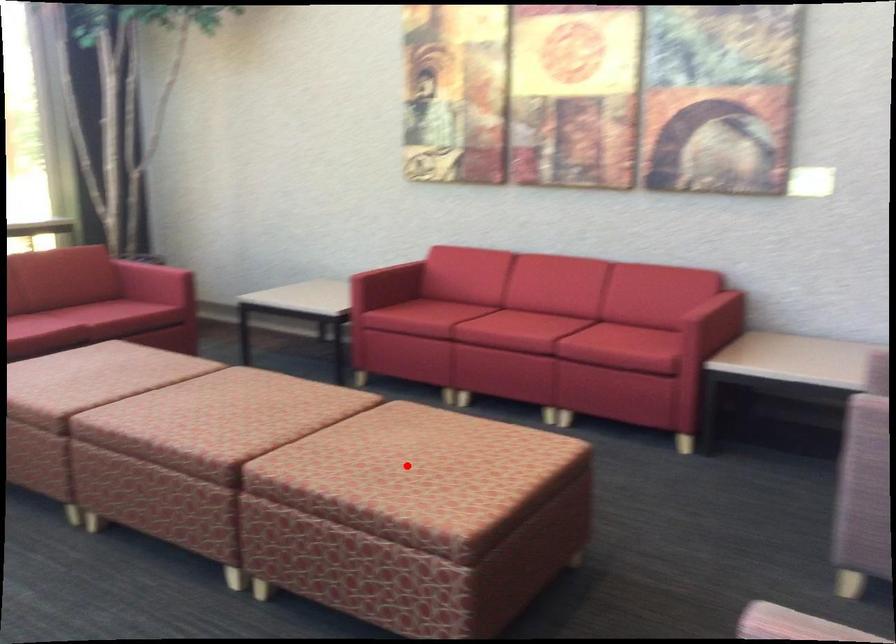
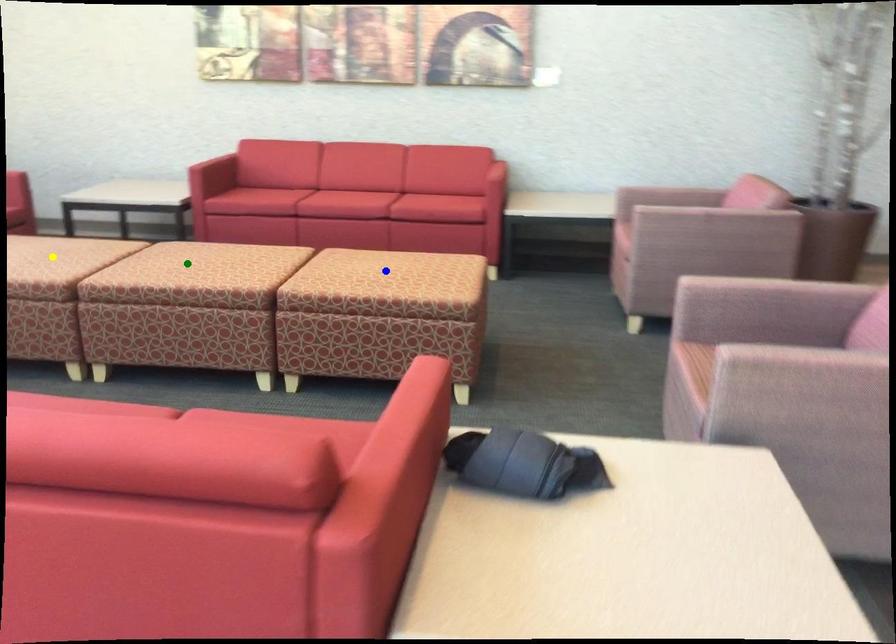
Question: I am providing you with two images of the same scene from different viewpoints. A red point is marked on the first image. You are given multiple points on the second image. Which spot in image 2 lines up with the point in image 1?

Choices:
 (A) yellow point
 (B) blue point
 (C) green point

Answer: (B)